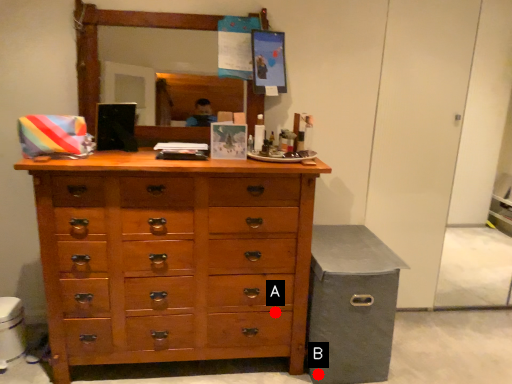
Question: Two points are circled on the image, labeled by A and B beside each circle. Among these points, which one is farthest from the camera?

Choices:
 (A) A is further
 (B) B is further

Answer: (B)